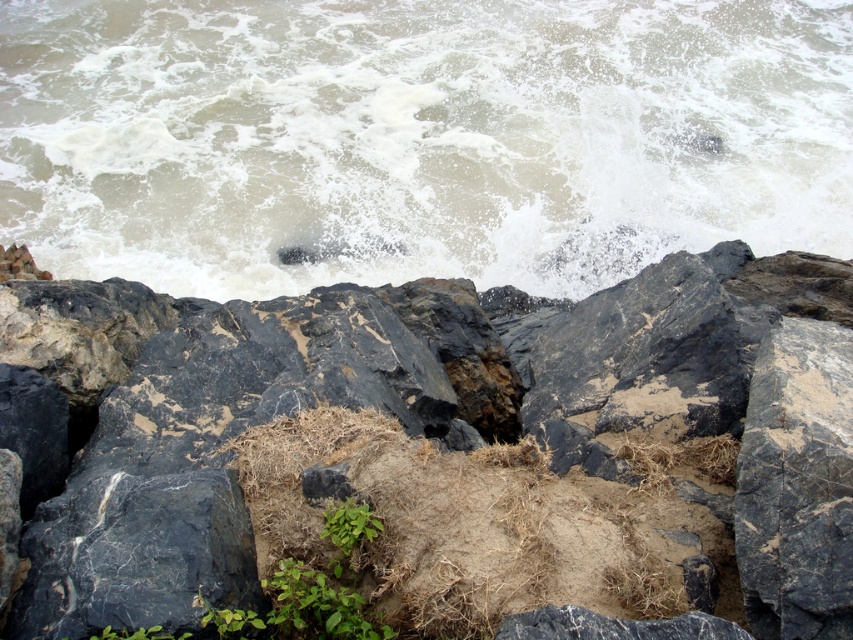
From the picture: Can you confirm if white frothy water at upper center is shorter than green leafy plant at center?

No.

Which is in front, point (259, 268) or point (352, 637)?

Point (352, 637)

Where is `white frothy water at upper center`? Image resolution: width=853 pixels, height=640 pixels. white frothy water at upper center is located at coordinates (418, 138).

Does black marble rock at center have a greater height compared to black rough rock at center?

Yes, black marble rock at center is taller than black rough rock at center.

From the picture: Can you confirm if black marble rock at center is positioned below black rough rock at center?

No.

Is point (775, 531) farther from camera compared to point (796, 525)?

Yes, it is behind point (796, 525).

You are a GUI agent. You are given a task and a screenshot of the screen. Output one action in this format:
    pyautogui.click(x=<x>, y=<y>)
    Task: Click on the black marble rock at center
    
    Given the screenshot: What is the action you would take?
    pyautogui.click(x=461, y=449)

From the picture: Who is more forward, (569, 451) or (334, 611)?

Point (334, 611) is more forward.

Is black marble rock at center shorter than green leafy plant at center?

No, black marble rock at center is not shorter than green leafy plant at center.

Which is in front, point (451, 502) or point (241, 632)?

Point (241, 632)

This screenshot has width=853, height=640. Identify the location of black marble rock at center. (461, 449).